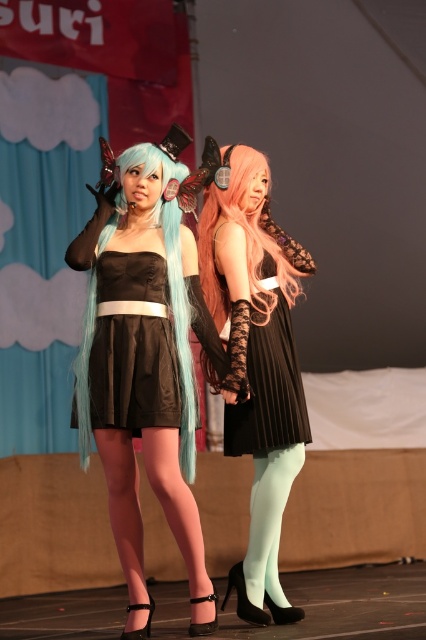
Can you confirm if black satin dress at center is wider than black pleated dress at center?

Yes.

The height and width of the screenshot is (640, 426). What are the coordinates of `black satin dress at center` in the screenshot? It's located at (134, 372).

Based on the photo, is matte black dress at center taller than black pleated dress at center?

Yes.

Can you confirm if matte black dress at center is bigger than black pleated dress at center?

Yes, matte black dress at center is bigger than black pleated dress at center.

Which is in front, point (124, 486) or point (259, 428)?

Point (124, 486)

Identify the location of matte black dress at center. The height and width of the screenshot is (640, 426). (146, 355).

Does satin black dress at center have a greater height compared to black satin dress at center?

Correct, satin black dress at center is much taller as black satin dress at center.

From the picture: Which of these two, satin black dress at center or black satin dress at center, stands taller?

With more height is satin black dress at center.

Identify the location of satin black dress at center. This screenshot has height=640, width=426. (256, 365).

Find the location of `satin black dress at center`. satin black dress at center is located at coordinates point(256,365).